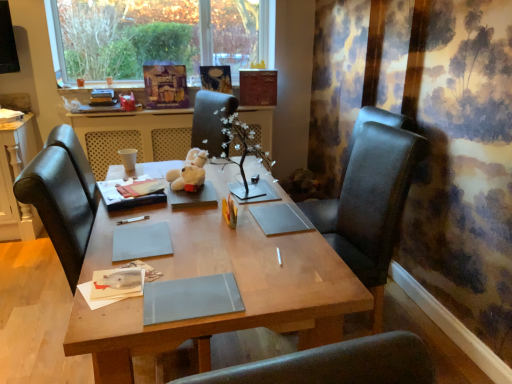
Locate an element on the screen. The height and width of the screenshot is (384, 512). free spot below matte gray notebook at center, positioned as the second notebook in left-to-right order (from a real-world perspective) is located at coordinates (201, 292).